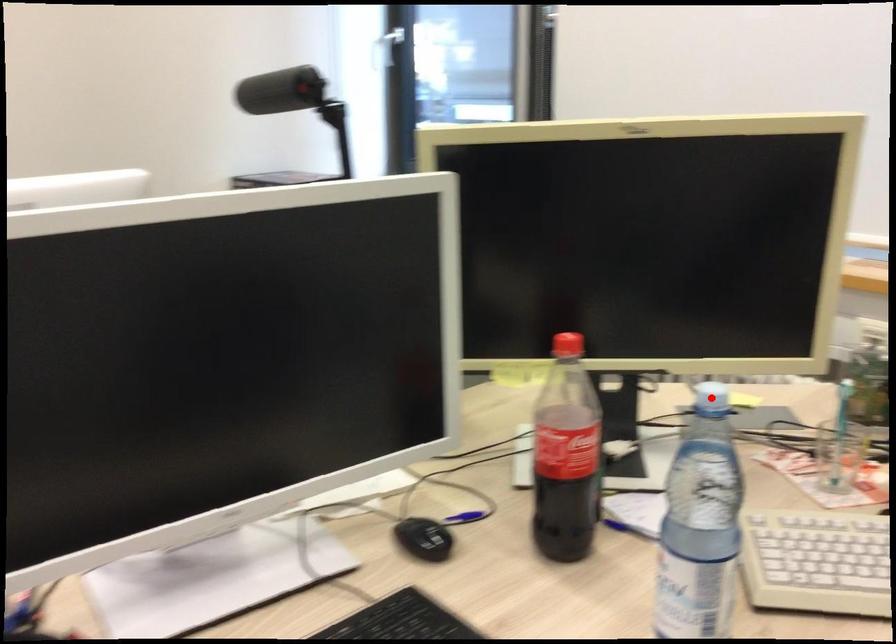
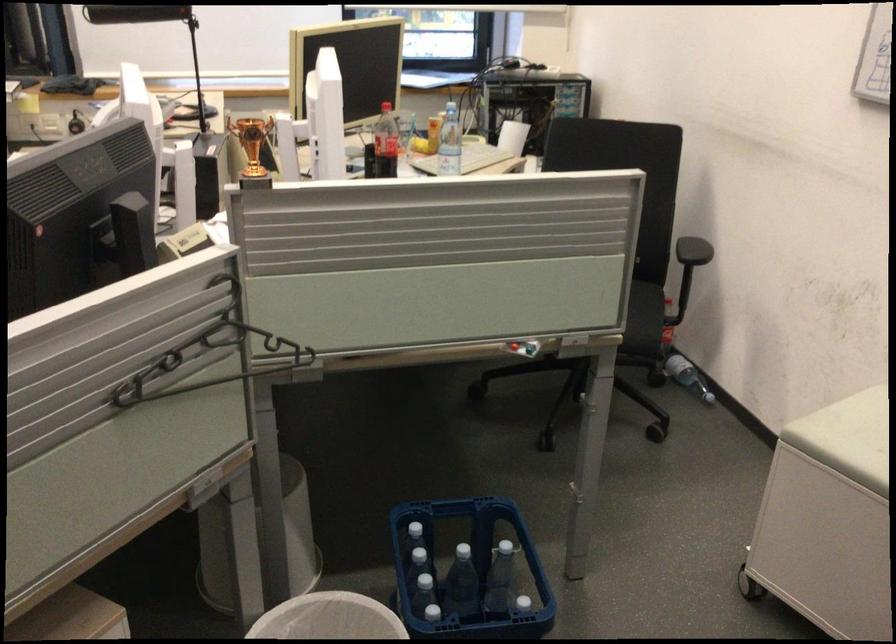
The point at the highlighted location is marked in the first image. Where is the corresponding point in the second image?

(440, 102)